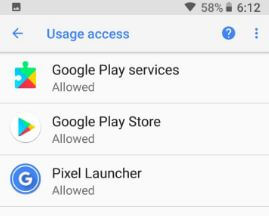
Locate an element on the screen. This screenshot has height=216, width=269. wifi is located at coordinates (192, 6).